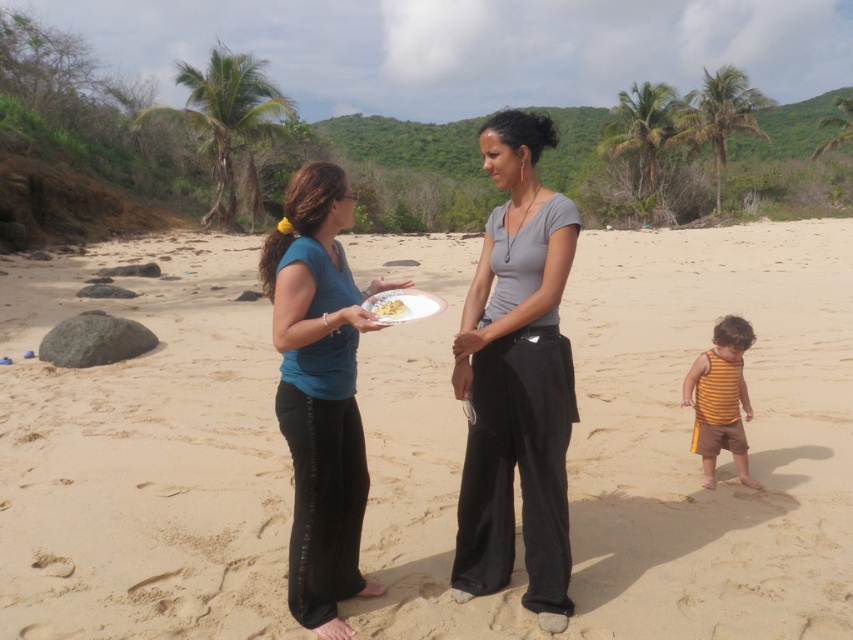
Question: Is beige sandy beach at center further to the viewer compared to striped cotton tank top at lower right?

Choices:
 (A) no
 (B) yes

Answer: (A)

Question: Does blue matte shirt at center appear on the left side of striped cotton tank top at lower right?

Choices:
 (A) no
 (B) yes

Answer: (B)

Question: Is gray matte shirt at center bigger than white matte plate at center?

Choices:
 (A) no
 (B) yes

Answer: (B)

Question: Which point is closer to the camera?

Choices:
 (A) (796, 225)
 (B) (486, 369)

Answer: (B)

Question: Among these points, which one is nearest to the camera?

Choices:
 (A) (322, 506)
 (B) (746, 481)

Answer: (A)

Question: Which object appears farthest from the camera in this image?

Choices:
 (A) white matte plate at center
 (B) beige sandy beach at center
 (C) striped cotton tank top at lower right

Answer: (C)